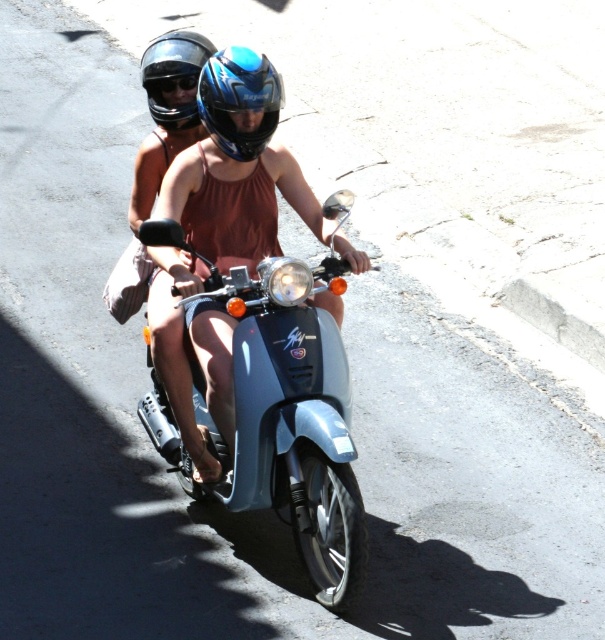
Question: Which object is closer to the camera taking this photo?

Choices:
 (A) metallic blue scooter at center
 (B) black matte goggles at upper center
 (C) matte black helmet at upper center
 (D) glossy blue helmet at center

Answer: (A)

Question: Is metallic blue scooter at center further to camera compared to matte black helmet at upper center?

Choices:
 (A) yes
 (B) no

Answer: (B)

Question: Which object is farther from the camera taking this photo?

Choices:
 (A) glossy blue helmet at center
 (B) matte black helmet at upper center

Answer: (B)

Question: Does glossy blue helmet at center lie behind matte black helmet at upper center?

Choices:
 (A) yes
 (B) no

Answer: (B)

Question: Based on their relative distances, which object is nearer to the black matte goggles at upper center?

Choices:
 (A) matte black helmet at upper center
 (B) glossy blue helmet at center
 (C) metallic blue scooter at center

Answer: (A)

Question: Does matte black helmet at upper center have a lesser width compared to black matte goggles at upper center?

Choices:
 (A) yes
 (B) no

Answer: (B)